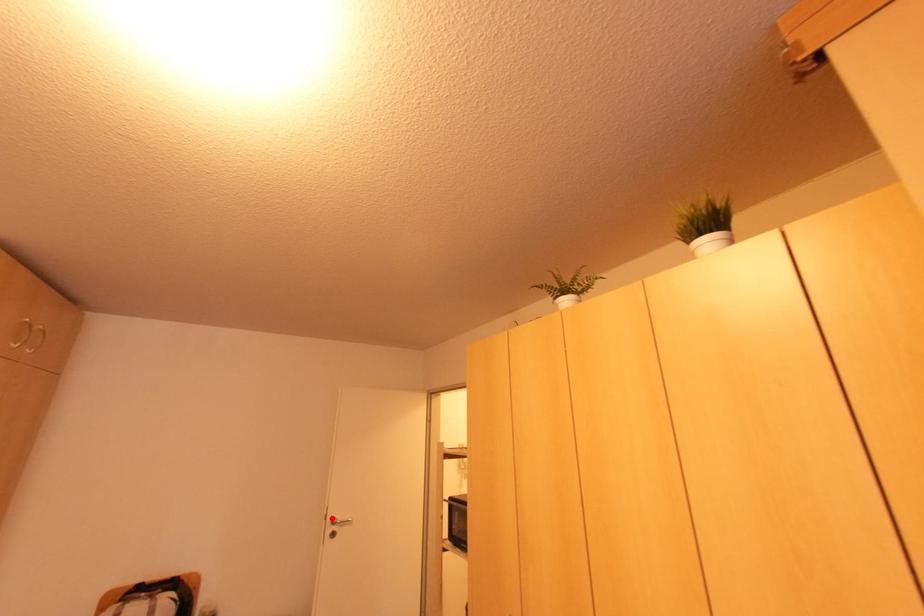
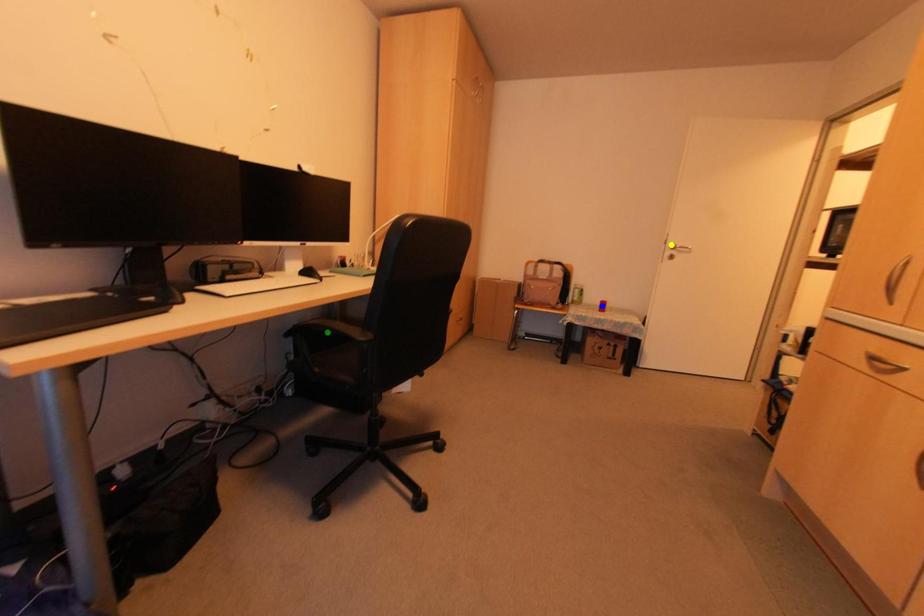
Question: I am providing you with two images of the same scene from different viewpoints. A red point is marked on the first image. You are given multiple points on the second image. Which mark in image 2 goes with the point in image 1?

Choices:
 (A) green point
 (B) yellow point
 (C) blue point

Answer: (B)